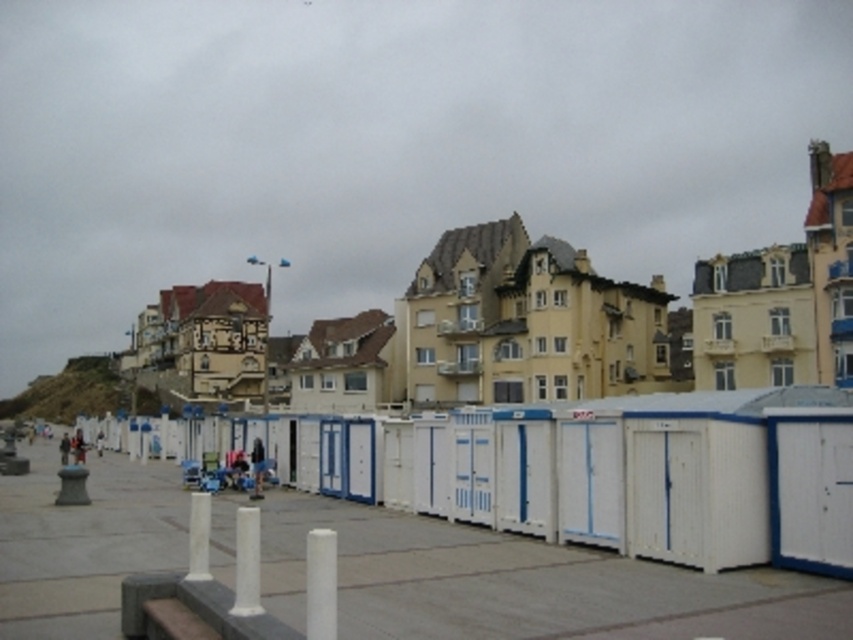
You are a tourist standing on the paved walkway and want to take a photo of the white wooden beach hut at center without the white matte pole at center appearing in the shot. Is this possible?

The white wooden beach hut at center is positioned over the white matte pole at center, so the pole will be visible in the photo unless you move to a different angle or position where the hut obscures the pole.

You are standing on the seaside promenade and want to take a photo of the white painted wood beach hut at center and the white matte pole at center. Which one is positioned to the right of the other?

The white painted wood beach hut at center is to the right of the white matte pole at center.